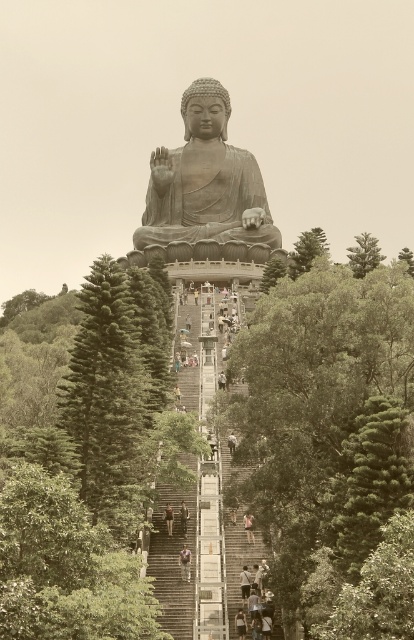
Does green textured pine tree at left appear on the right side of green leafy tree at lower right?

In fact, green textured pine tree at left is to the left of green leafy tree at lower right.

In the scene shown: Measure the distance between green textured pine tree at left and green leafy tree at lower right.

green textured pine tree at left and green leafy tree at lower right are 73.38 feet apart from each other.

This screenshot has width=414, height=640. Identify the location of green textured pine tree at left. (110, 401).

Who is positioned more to the left, light brown fabric shirt at center or dark brown hair at center?

Positioned to the left is dark brown hair at center.

Who is more forward, (247, 538) or (231, 515)?

Positioned in front is point (247, 538).

Which is behind, point (248, 538) or point (235, 506)?

Positioned behind is point (248, 538).

The height and width of the screenshot is (640, 414). In order to click on light brown fabric shirt at center in this screenshot , I will do `click(248, 525)`.

Between bronze statue at center and camouflage pants at center, which one has less height?

With less height is camouflage pants at center.

Which of these two, bronze statue at center or camouflage pants at center, stands taller?

With more height is bronze statue at center.

Between point (259, 209) and point (183, 557), which one is positioned in front?

Point (183, 557)

Identify the location of bronze statue at center. (204, 180).